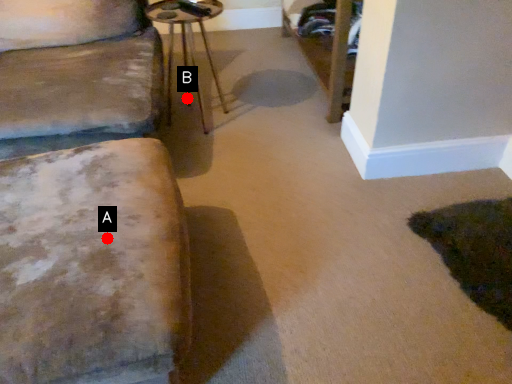
Question: Two points are circled on the image, labeled by A and B beside each circle. Which of the following is the farthest from the observer?

Choices:
 (A) A is further
 (B) B is further

Answer: (B)